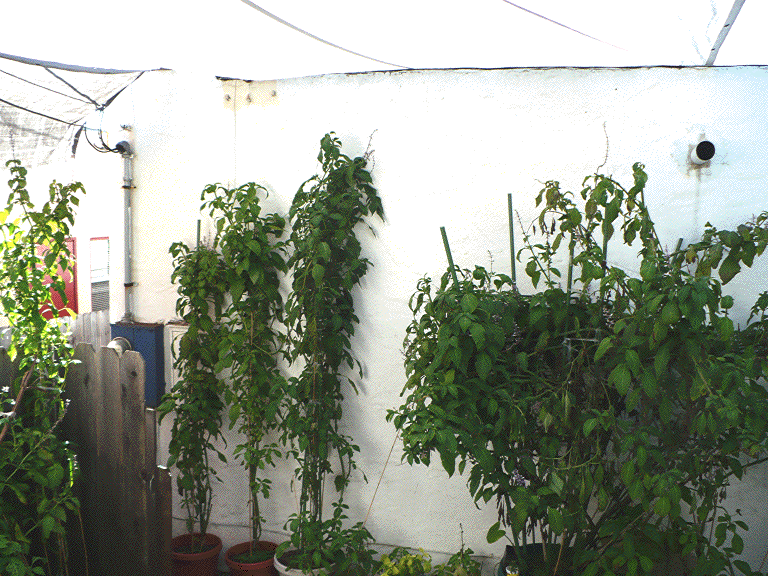
What are the coordinates of `top rim of white pot` in the screenshot? It's located at (282, 569).